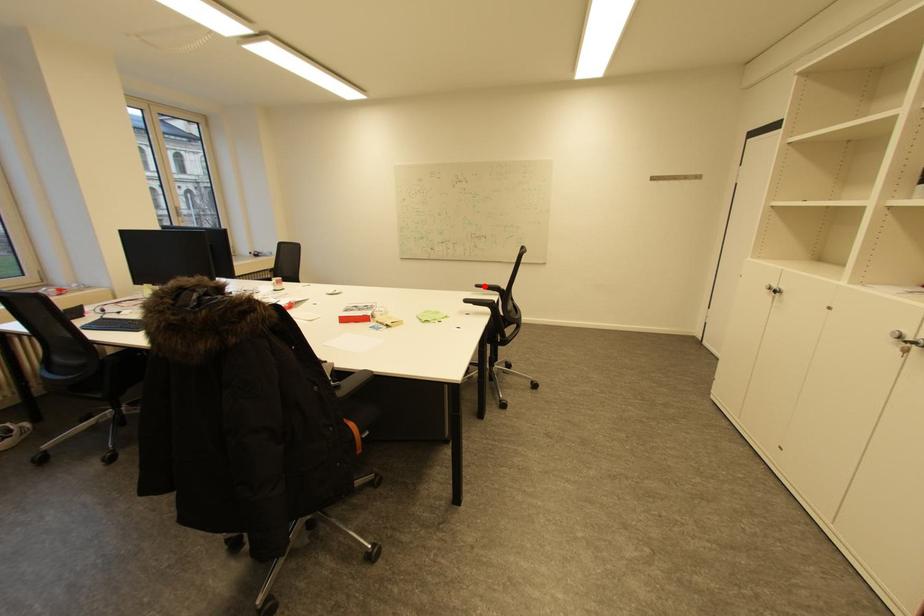
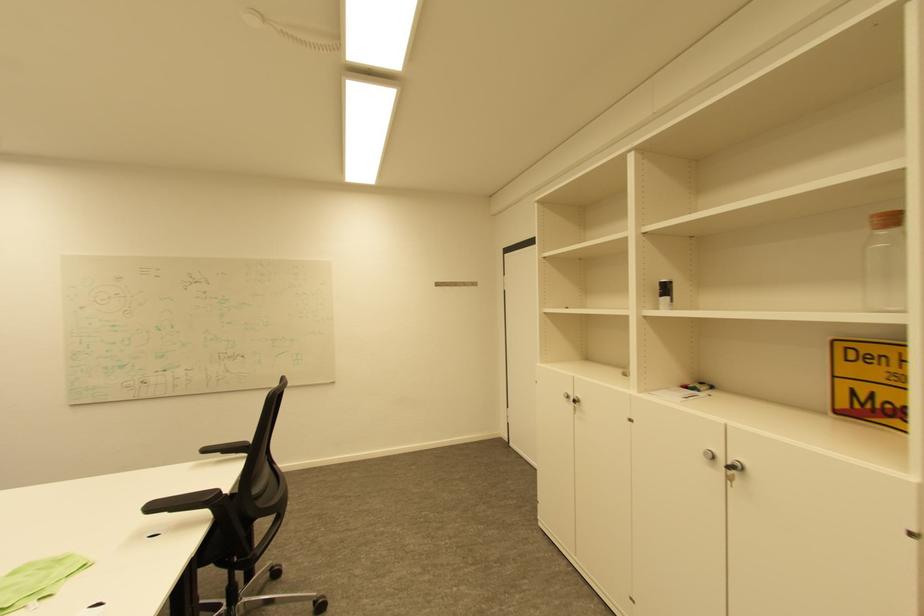
Question: I am providing you with two images of the same scene from different viewpoints. A red point is marked on the first image. At the location where the point appears in image 1, is it still visible in image 2?

Choices:
 (A) Yes
 (B) No

Answer: (A)